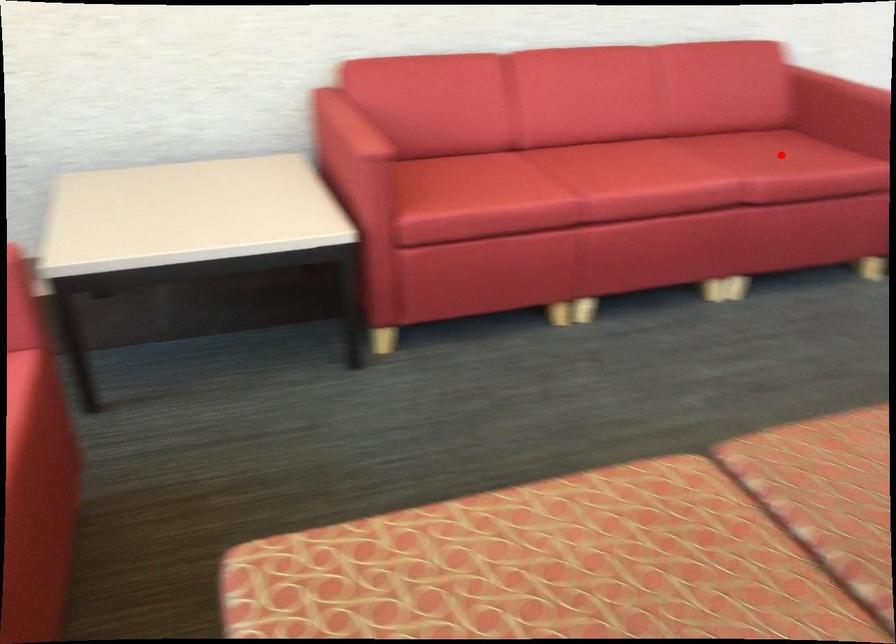
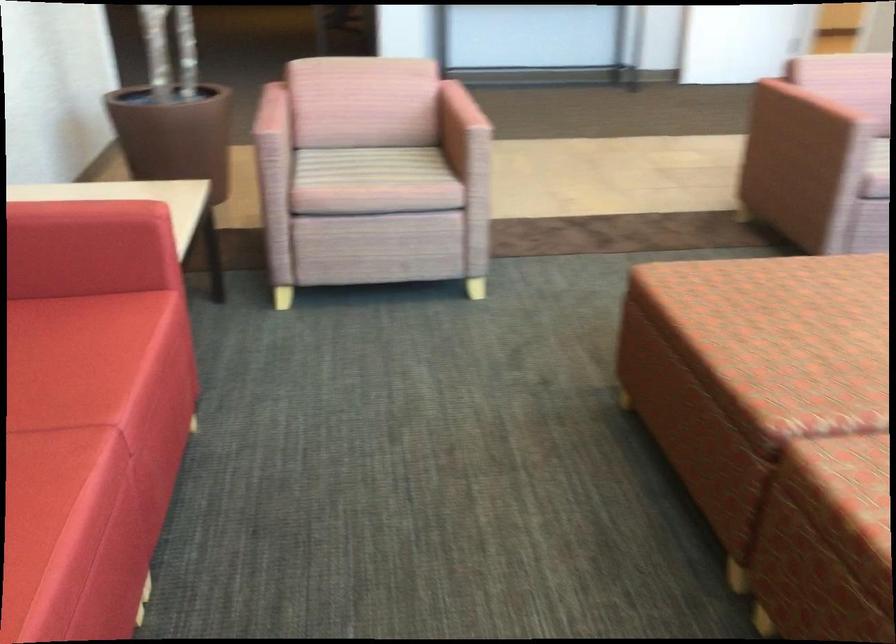
Question: A red point is marked in image1. In image2, is the corresponding 3D point closer to the camera or farther? Reply with the corresponding letter.

Choices:
 (A) The corresponding 3D point is closer.
 (B) The corresponding 3D point is farther.

Answer: (A)